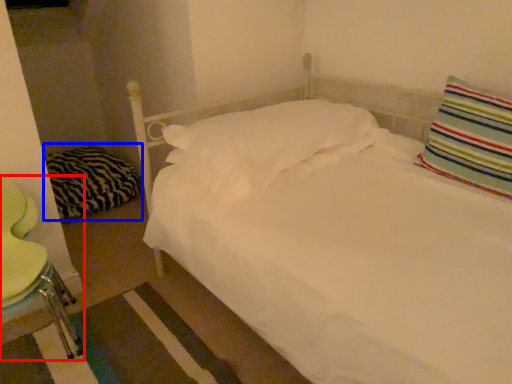
Question: Which of the following is the closest to the observer, swivel chair (highlighted by a red box) or pillow (highlighted by a blue box)?

Choices:
 (A) swivel chair
 (B) pillow

Answer: (A)